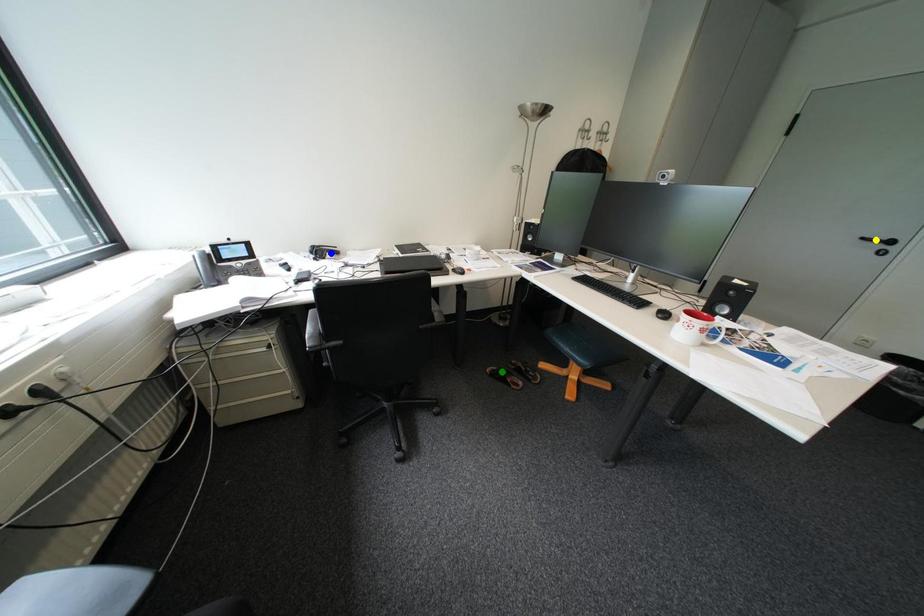
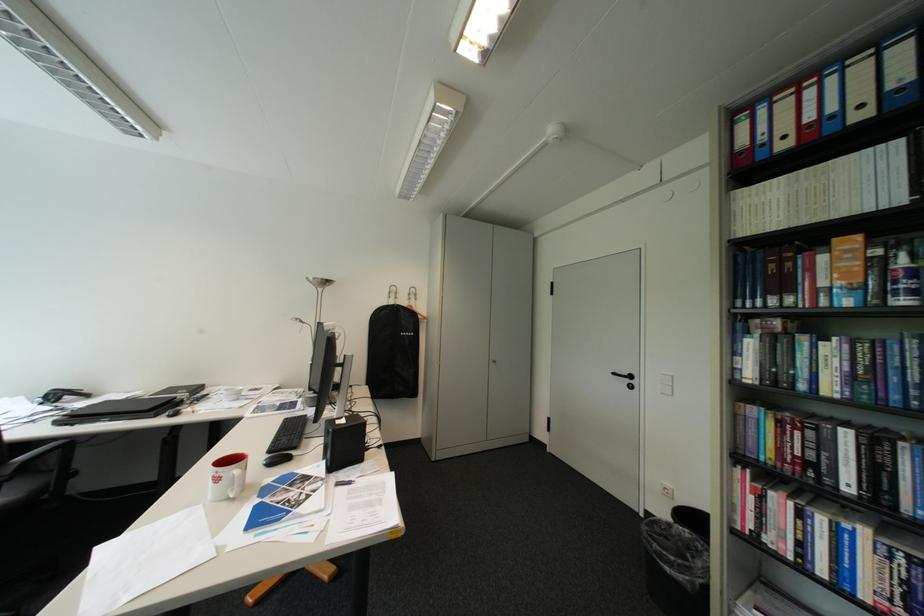
I am providing you with two images of the same scene from different viewpoints. Three points are marked in image1. Which point corresponds to a part or object that is occluded in image2?In image1, three points are marked. Which of them correspond to a part or object that is occluded in image2?Among the three points shown in image1, which one corresponds to a part or object that is no longer visible due to occlusion in image2?

Invisible in image2: green point.